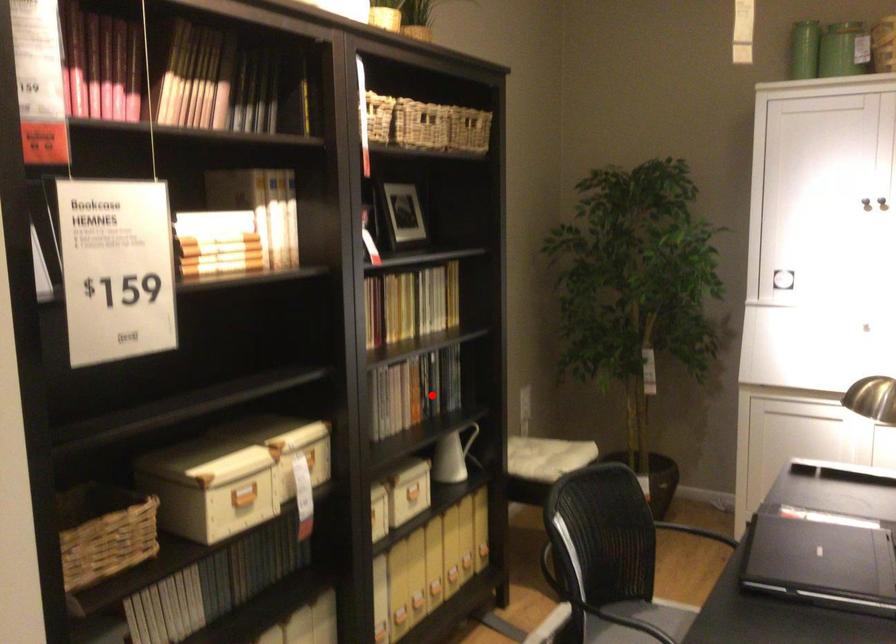
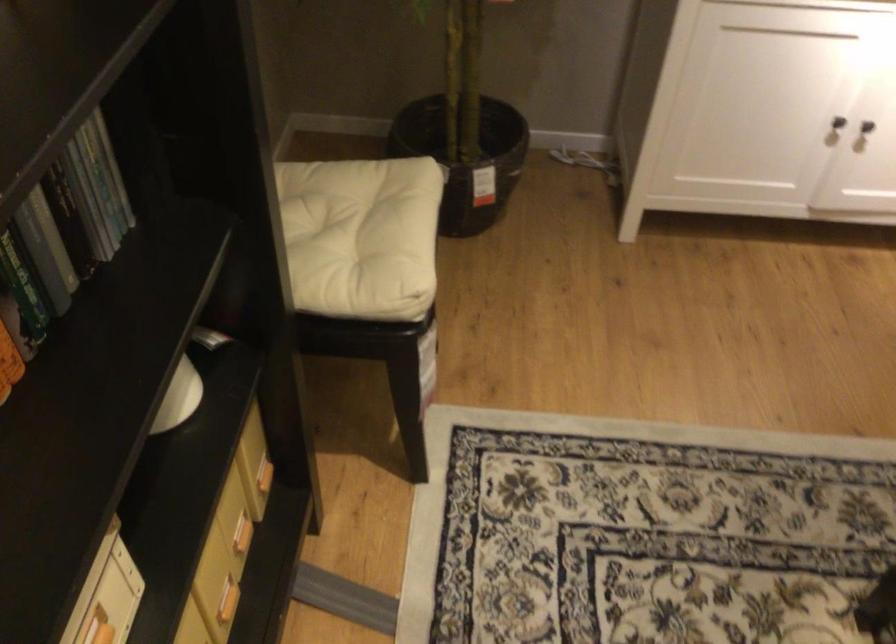
Locate, in the second image, the point that corresponds to the highlighted location in the first image.

(53, 238)